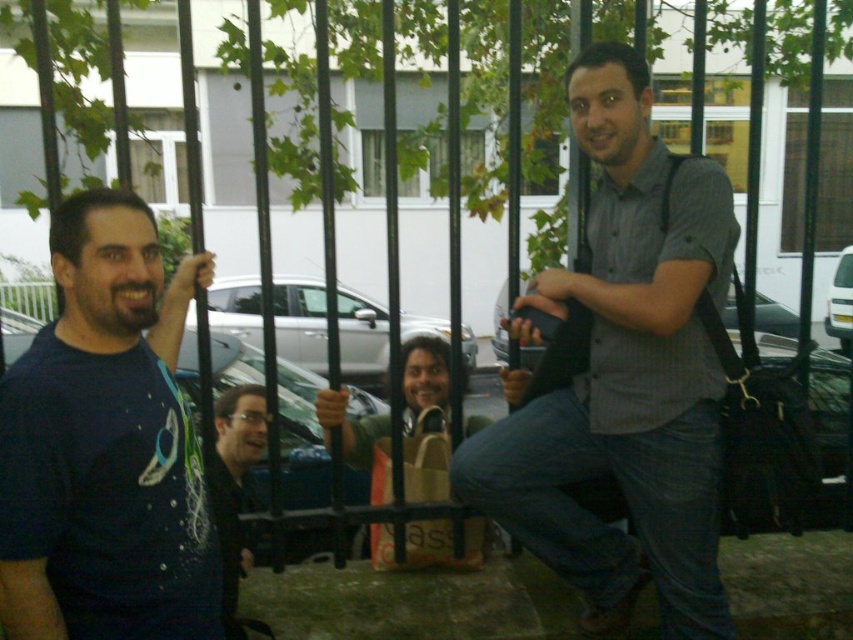
Can you confirm if dark blue t-shirt at left is wider than matte black glasses at center?

No.

Is point (142, 216) positioned before point (254, 410)?

Yes, point (142, 216) is closer to viewer.

At what (x,y) coordinates should I click in order to perform the action: click on dark blue t-shirt at left. Please return your answer as a coordinate pair (x, y). This screenshot has width=853, height=640. Looking at the image, I should click on (105, 445).

Measure the distance between point (709, 465) and camera.

The distance of point (709, 465) from camera is 6.84 feet.

Is point (556, 541) positioned in front of point (73, 236)?

No.

You are a GUI agent. You are given a task and a screenshot of the screen. Output one action in this format:
    pyautogui.click(x=<x>, y=<y>)
    Task: Click on the gray checkered shirt at center
    This screenshot has height=640, width=853.
    Given the screenshot: What is the action you would take?
    pyautogui.click(x=625, y=378)

In the scene shown: Does gray checkered shirt at center appear on the right side of matte black glasses at center?

Indeed, gray checkered shirt at center is positioned on the right side of matte black glasses at center.

Is gray checkered shirt at center shorter than matte black glasses at center?

Incorrect, gray checkered shirt at center's height does not fall short of matte black glasses at center's.

Measure the distance between point (704, 401) and camera.

The distance of point (704, 401) from camera is 2.07 meters.

This screenshot has width=853, height=640. In order to click on gray checkered shirt at center in this screenshot , I will do `click(625, 378)`.